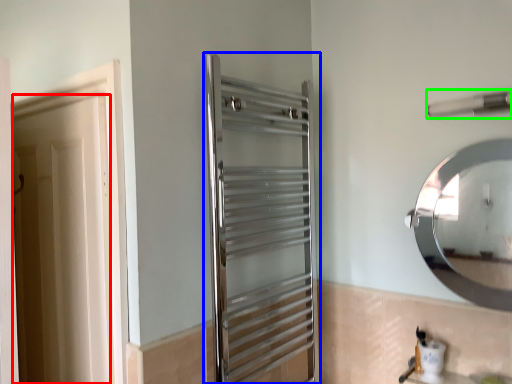
Question: Which object is the closest to the door (highlighted by a red box)? Choose among these: screen door (highlighted by a blue box) or towel bar (highlighted by a green box).

Choices:
 (A) screen door
 (B) towel bar

Answer: (A)